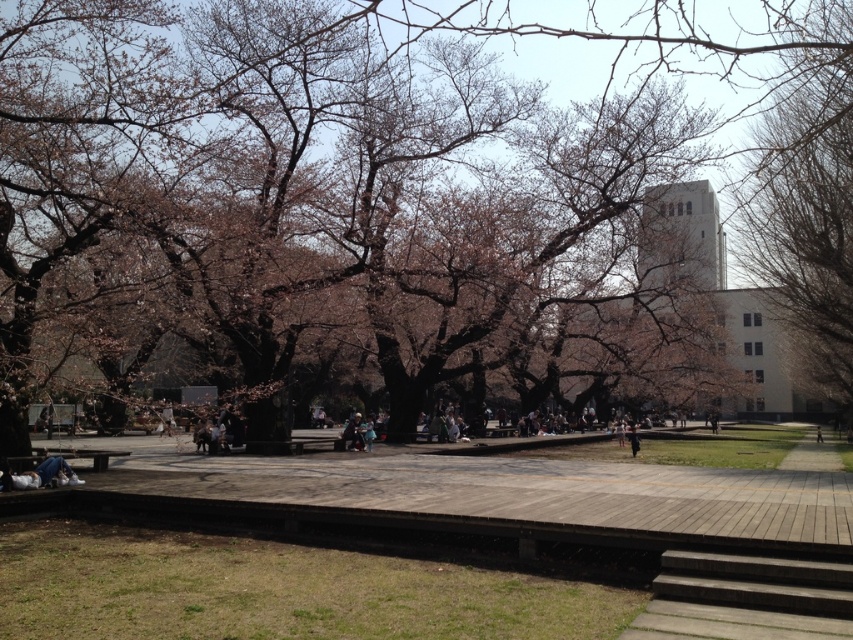
Is pink blossoms at center to the right of bare branches at upper right from the viewer's perspective?

In fact, pink blossoms at center is to the left of bare branches at upper right.

How distant is pink blossoms at center from bare branches at upper right?

pink blossoms at center and bare branches at upper right are 7.51 meters apart.

Find the location of `pink blossoms at center`. pink blossoms at center is located at coordinates (399, 202).

At what (x,y) coordinates should I click in order to perform the action: click on pink blossoms at center. Please return your answer as a coordinate pair (x, y). The height and width of the screenshot is (640, 853). Looking at the image, I should click on (399, 202).